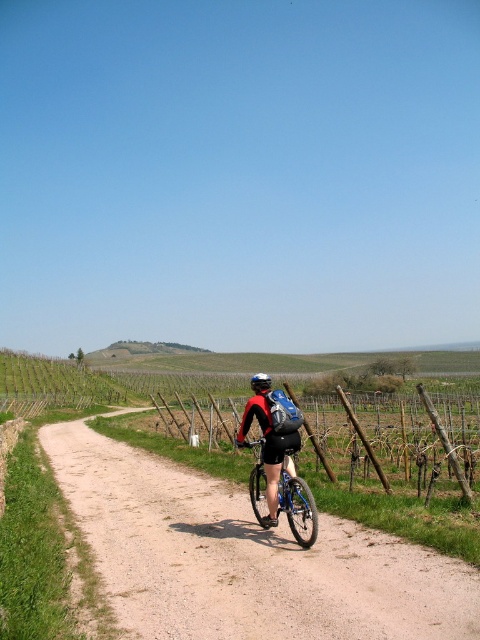
You are planning to take a photo of the blue metallic bicycle at center while standing on the dirt path at center. Considering the size relationship between the two, which object should you focus on to ensure the bicycle is clearly visible in the photo?

The dirt path at center is larger in size than the blue metallic bicycle at center, so focusing on the dirt path at center will ensure the bicycle is clearly visible as it will be within the frame and properly scaled against the larger path.